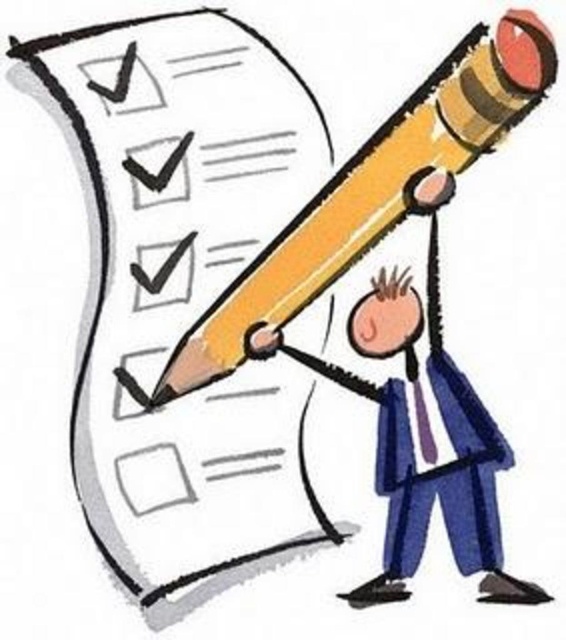
Is yellow matte pencil at upper center to the right of blue fabric business suit at lower right from the viewer's perspective?

No, yellow matte pencil at upper center is not to the right of blue fabric business suit at lower right.

Who is positioned more to the left, yellow matte pencil at upper center or blue fabric business suit at lower right?

From the viewer's perspective, yellow matte pencil at upper center appears more on the left side.

Locate an element on the screen. yellow matte pencil at upper center is located at coordinates (374, 189).

Is blue fabric business suit at lower right smaller than pink matte head at center?

Actually, blue fabric business suit at lower right might be larger than pink matte head at center.

Does point (473, 538) come in front of point (372, 346)?

Yes.

This screenshot has width=566, height=640. Identify the location of blue fabric business suit at lower right. (440, 476).

Can you confirm if yellow matte pencil at upper center is taller than pink matte head at center?

Yes, yellow matte pencil at upper center is taller than pink matte head at center.

Is yellow matte pencil at upper center to the left of pink matte head at center from the viewer's perspective?

Correct, you'll find yellow matte pencil at upper center to the left of pink matte head at center.

Is point (471, 97) positioned before point (375, 328)?

Yes, it is.

This screenshot has width=566, height=640. I want to click on yellow matte pencil at upper center, so click(374, 189).